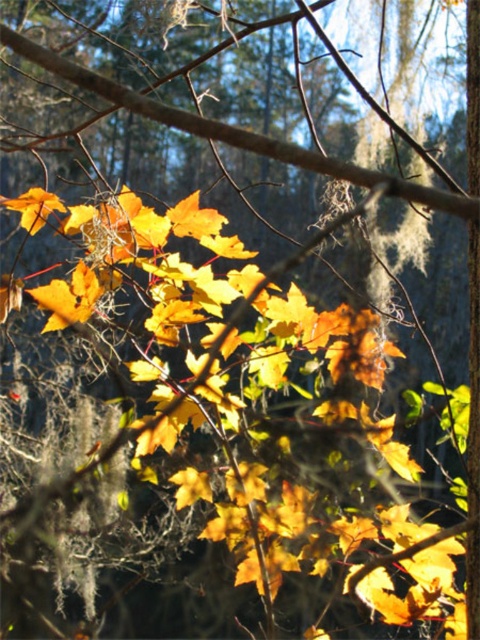
You are an artist sketching the tree branch and need to place the matte yellow maple leaf at center in your drawing. According to the image, where should you position it in terms of coordinates?

The matte yellow maple leaf at center should be positioned at coordinates approximately 0.466 on the x axis and 0.144 on the y axis.

You are standing in a forest and see a point marked at coordinates (69, 298). According to the scene, what object is located at that point?

The point at coordinates (69, 298) marks a matte yellow maple leaf at center.